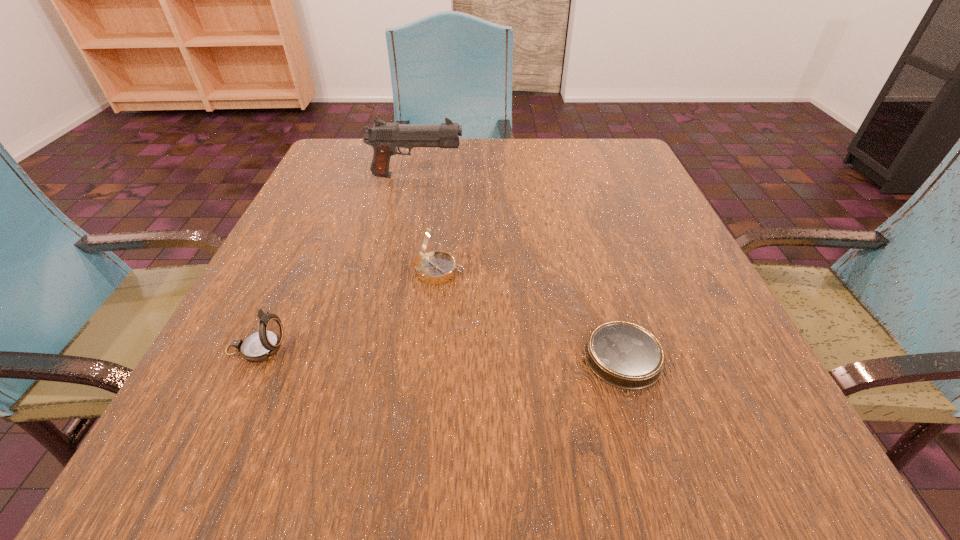
You are a GUI agent. You are given a task and a screenshot of the screen. Output one action in this format:
    pyautogui.click(x=<x>, y=<y>)
    Task: Click on the free location that satisfies the following two spatial constraints: 1. with the dial facing the second compass from right to left; 2. on the right side of the shortest compass
    The width and height of the screenshot is (960, 540).
    Given the screenshot: What is the action you would take?
    pyautogui.click(x=430, y=357)

Identify the location of free space that satisfies the following two spatial constraints: 1. in the direction the farthest object is aimed; 2. on the right side of the rightmost object. (377, 357).